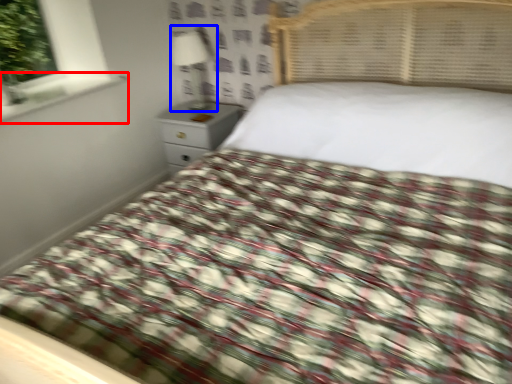
Question: Which object appears closest to the camera in this image, window sill (highlighted by a red box) or lamp (highlighted by a blue box)?

Choices:
 (A) window sill
 (B) lamp

Answer: (A)